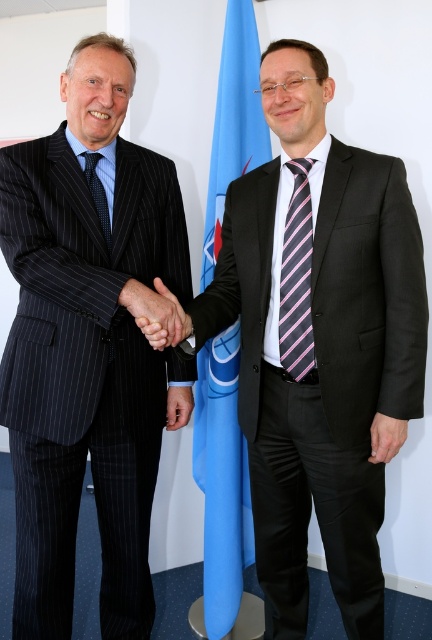
You are an interior designer planning to hang a new flag in the same location as the blue fabric flag at center. The wall is 3 meters wide and 2 meters tall. What are the coordinates of the center point where you should place the new flag to match its original position?

The blue fabric flag at center is positioned at point (222, 493). To replicate this placement, the new flag should be centered at coordinates (222, 493) on the wall.

You are an artist creating a sketch of the scene. You need to ensure the proportions are accurate. Which object, the matte black suit at center or the matte black hand at center, should you draw larger in your sketch?

The matte black suit at center should be drawn larger in the sketch because it has a greater height compared to the matte black hand at center.

You are standing in the professional setting shown in the image. There is a point marked at coordinates (222, 493). Which object from the scene does this point belong to?

The point (222, 493) is on the blue fabric flag at center.